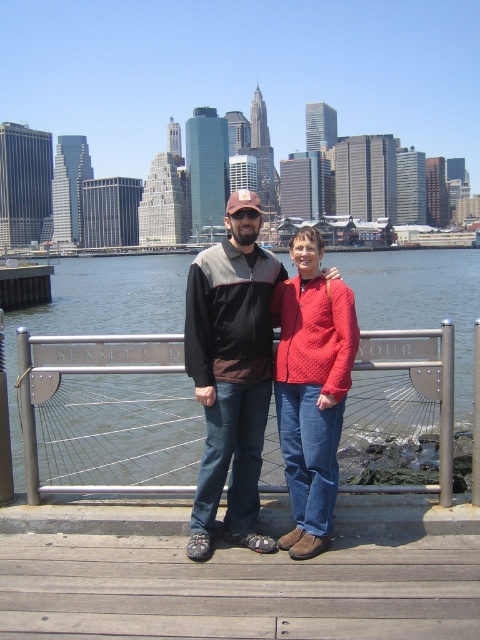
Does clear water at center come in front of matte black jacket at center?

No.

Can you confirm if clear water at center is smaller than matte black jacket at center?

Incorrect, clear water at center is not smaller in size than matte black jacket at center.

Identify the location of clear water at center. This screenshot has width=480, height=640. [99, 308].

Can you confirm if wooden at lower center is bigger than quilted red sweater at center?

No.

What do you see at coordinates (236, 589) in the screenshot? I see `wooden at lower center` at bounding box center [236, 589].

What are the coordinates of `wooden at lower center` in the screenshot? It's located at pyautogui.click(x=236, y=589).

Describe the element at coordinates (99, 308) in the screenshot. I see `clear water at center` at that location.

Consider the image. Who is positioned more to the right, clear water at center or quilted red sweater at center?

Positioned to the right is quilted red sweater at center.

This screenshot has height=640, width=480. I want to click on clear water at center, so click(x=99, y=308).